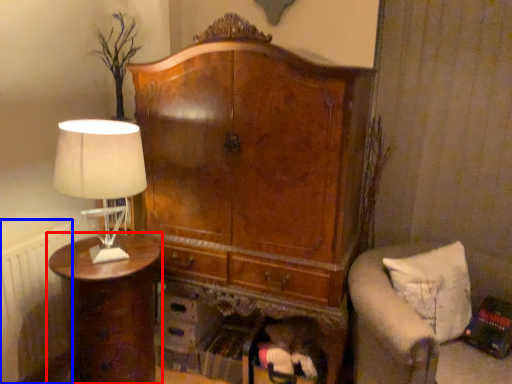
Question: Which object appears farthest to the camera in this image, nightstand (highlighted by a red box) or radiator (highlighted by a blue box)?

Choices:
 (A) nightstand
 (B) radiator

Answer: (B)